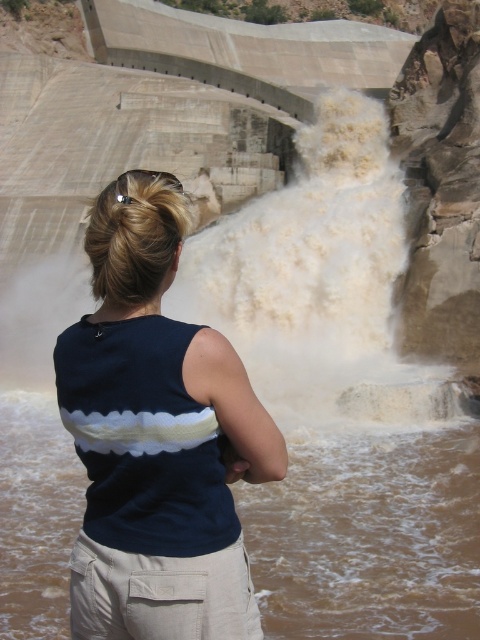
You are a safety inspector at the dam and need to ensure that the distance between the brown muddy water at lower center and the white frothy water at center is at least 20 meters to prevent erosion. Based on the scene description, is the current distance sufficient?

The brown muddy water at lower center is 19.28 meters away from the white frothy water at center. Since 19.28 meters is less than the required 20 meters, the distance is insufficient to prevent erosion.

Based on the photo, you are a safety inspector at the dam and need to ensure that the navy blue fabric shirt at center and the white frothy water at center are positioned safely. Based on their current positions, which object is closer to the ground?

The navy blue fabric shirt at center is located below the white frothy water at center, so the navy blue fabric shirt at center is closer to the ground.

You are a safety inspector at the dam and need to ensure that the observer wearing the navy blue fabric shirt at center can safely monitor the brown muddy water at lower center without getting wet. Based on their positions, is there a risk of the water splashing up to their location?

The navy blue fabric shirt at center is much taller than the brown muddy water at lower center, so the observer is positioned at a higher elevation. This means the water splashing from the lower center is unlikely to reach their location, making it safe for them to monitor from there.